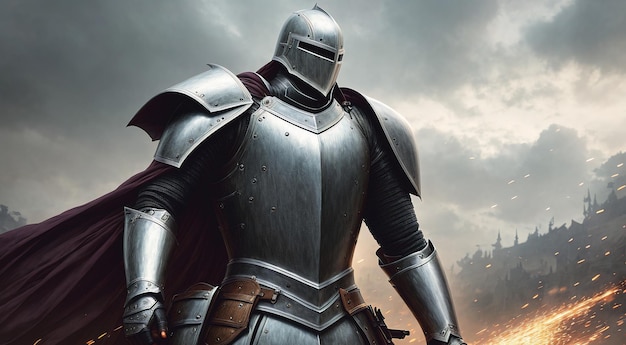
You are a GUI agent. You are given a task and a screenshot of the screen. Output one action in this format:
    pyautogui.click(x=<x>, y=<y>)
    Task: Click on the holder
    The image size is (626, 345).
    Given the screenshot: What is the action you would take?
    pyautogui.click(x=237, y=309), pyautogui.click(x=360, y=323)